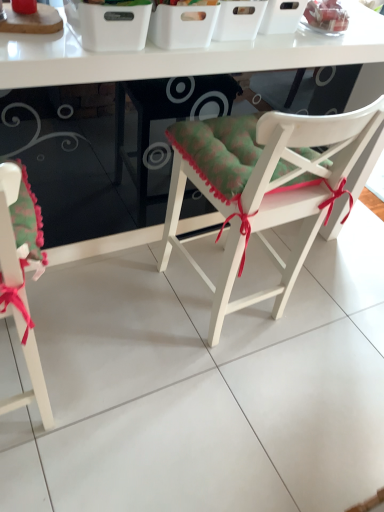
This screenshot has height=512, width=384. In order to click on free spot in front of white wood chair at center, arranged as the second chair when viewed from the left in this screenshot , I will do `click(205, 395)`.